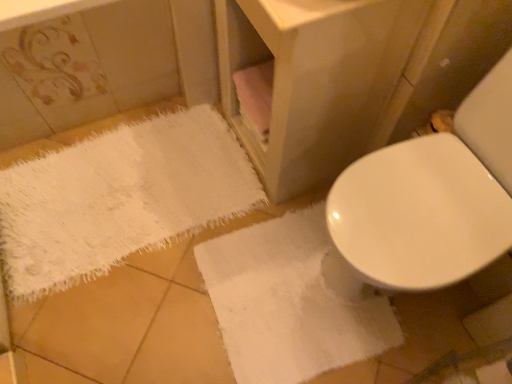
I want to click on free space between white fluffy bath towel at lower left, the first bath towel positioned from the left, and white fluffy bath towel at lower right, the first bath towel positioned from the right, so click(150, 309).